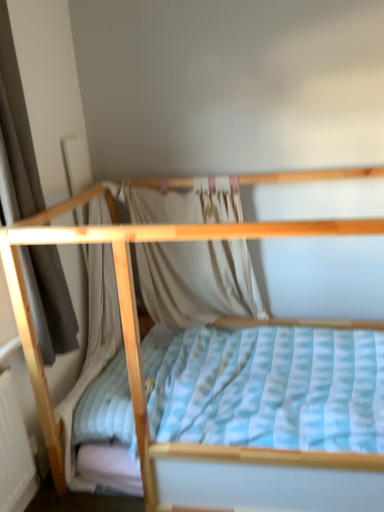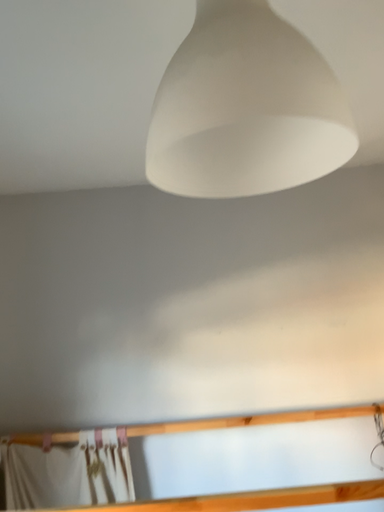
Question: How did the camera likely rotate when shooting the video?

Choices:
 (A) rotated downward
 (B) rotated upward

Answer: (B)